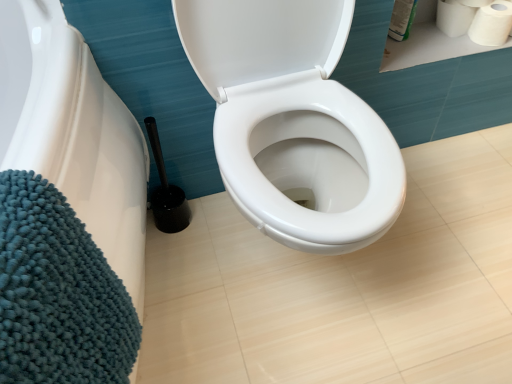
What is the approximate width of white matte toilet paper at upper right, arranged as the first toilet paper when viewed from the left?

The width of white matte toilet paper at upper right, arranged as the first toilet paper when viewed from the left, is 11.30 centimeters.

Measure the distance between white matte toilet paper at upper right, arranged as the first toilet paper when viewed from the left, and camera.

The distance of white matte toilet paper at upper right, arranged as the first toilet paper when viewed from the left, from camera is 3.95 feet.

Where is `black plastic toilet brush at lower left`? black plastic toilet brush at lower left is located at coordinates (166, 191).

Locate an element on the screen. This screenshot has height=384, width=512. white matte toilet paper at upper right, which is the 2th toilet paper in left-to-right order is located at coordinates (490, 24).

From a real-world perspective, is teal plush bath mat at lower left under black plastic toilet brush at lower left?

Incorrect, from a real-world perspective, teal plush bath mat at lower left is higher than black plastic toilet brush at lower left.

Does teal plush bath mat at lower left have a greater height compared to black plastic toilet brush at lower left?

Yes.

Considering the points (57, 77) and (166, 204), which point is in front, point (57, 77) or point (166, 204)?

The point (57, 77) is closer.

Can you see teal plush bath mat at lower left touching black plastic toilet brush at lower left?

teal plush bath mat at lower left and black plastic toilet brush at lower left are not in contact.

Considering the positions of points (120, 121) and (457, 16), is point (120, 121) closer to camera compared to point (457, 16)?

Yes.

Can we say teal plush bath mat at lower left lies outside white matte toilet paper at upper right, marked as the 2th toilet paper in a right-to-left arrangement?

Yes, teal plush bath mat at lower left is located beyond the bounds of white matte toilet paper at upper right, marked as the 2th toilet paper in a right-to-left arrangement.

From a real-world perspective, is teal plush bath mat at lower left physically located above or below white matte toilet paper at upper right, marked as the 2th toilet paper in a right-to-left arrangement?

teal plush bath mat at lower left is situated higher than white matte toilet paper at upper right, marked as the 2th toilet paper in a right-to-left arrangement, in the real world.

Which is more to the right, teal plush bath mat at lower left or white matte toilet paper at upper right, marked as the 2th toilet paper in a right-to-left arrangement?

From the viewer's perspective, white matte toilet paper at upper right, marked as the 2th toilet paper in a right-to-left arrangement, appears more on the right side.

From the image's perspective, which one is positioned higher, teal plush bath mat at lower left or white matte toilet paper at upper right, which is the 2th toilet paper in left-to-right order?

white matte toilet paper at upper right, which is the 2th toilet paper in left-to-right order, appears higher in the image.

Can you confirm if teal plush bath mat at lower left is positioned to the right of white matte toilet paper at upper right, the 1th toilet paper positioned from the right?

In fact, teal plush bath mat at lower left is to the left of white matte toilet paper at upper right, the 1th toilet paper positioned from the right.

What's the angular difference between teal plush bath mat at lower left and white matte toilet paper at upper right, which is the 2th toilet paper in left-to-right order,'s facing directions?

The angular difference between teal plush bath mat at lower left and white matte toilet paper at upper right, which is the 2th toilet paper in left-to-right order, is 65.6 degrees.

Which of these two, teal plush bath mat at lower left or white matte toilet paper at upper right, which is the 2th toilet paper in left-to-right order, is bigger?

Bigger between the two is teal plush bath mat at lower left.

Is white matte toilet paper at upper right, the 1th toilet paper positioned from the right, far away from teal plush bath mat at lower left?

Yes, white matte toilet paper at upper right, the 1th toilet paper positioned from the right, is far from teal plush bath mat at lower left.

From the image's perspective, would you say white matte toilet paper at upper right, the 1th toilet paper positioned from the right, is shown under teal plush bath mat at lower left?

No.

Is teal plush bath mat at lower left inside white matte toilet paper at upper right, the 1th toilet paper positioned from the right?

No, teal plush bath mat at lower left is not a part of white matte toilet paper at upper right, the 1th toilet paper positioned from the right.

Is point (504, 7) farther from viewer compared to point (36, 153)?

Yes, it is.

Does white matte toilet paper at upper right, the 1th toilet paper positioned from the right, have a smaller size compared to black plastic toilet brush at lower left?

Yes, white matte toilet paper at upper right, the 1th toilet paper positioned from the right, is smaller than black plastic toilet brush at lower left.

What's the angular difference between white matte toilet paper at upper right, which is the 2th toilet paper in left-to-right order, and black plastic toilet brush at lower left's facing directions?

1.42 degrees separate the facing orientations of white matte toilet paper at upper right, which is the 2th toilet paper in left-to-right order, and black plastic toilet brush at lower left.

Is white matte toilet paper at upper right, the 1th toilet paper positioned from the right, far away from black plastic toilet brush at lower left?

Actually, white matte toilet paper at upper right, the 1th toilet paper positioned from the right, and black plastic toilet brush at lower left are a little close together.

Is black plastic toilet brush at lower left oriented towards white matte toilet paper at upper right, marked as the 2th toilet paper in a right-to-left arrangement?

No, black plastic toilet brush at lower left does not turn towards white matte toilet paper at upper right, marked as the 2th toilet paper in a right-to-left arrangement.

Is black plastic toilet brush at lower left surrounding white matte toilet paper at upper right, marked as the 2th toilet paper in a right-to-left arrangement?

That's incorrect, white matte toilet paper at upper right, marked as the 2th toilet paper in a right-to-left arrangement, is not inside black plastic toilet brush at lower left.

From a real-world perspective, between black plastic toilet brush at lower left and white matte toilet paper at upper right, marked as the 2th toilet paper in a right-to-left arrangement, who is vertically higher?

In real-world perspective, white matte toilet paper at upper right, marked as the 2th toilet paper in a right-to-left arrangement, is above.

Between black plastic toilet brush at lower left and teal plush bath mat at lower left, which one has smaller size?

Smaller between the two is black plastic toilet brush at lower left.

How many degrees apart are the facing directions of black plastic toilet brush at lower left and teal plush bath mat at lower left?

The angular difference between black plastic toilet brush at lower left and teal plush bath mat at lower left is 64.1 degrees.

How distant is black plastic toilet brush at lower left from teal plush bath mat at lower left?

black plastic toilet brush at lower left and teal plush bath mat at lower left are 11.26 inches apart from each other.

Between black plastic toilet brush at lower left and teal plush bath mat at lower left, which one has more height?

Standing taller between the two is teal plush bath mat at lower left.

Identify the location of brush that is on the right side of teal plush bath mat at lower left. (166, 191).

The height and width of the screenshot is (384, 512). Identify the location of bath positioned vertically above the white matte toilet paper at upper right, arranged as the first toilet paper when viewed from the left (from a real-world perspective). (74, 132).

Based on their spatial positions, is black plastic toilet brush at lower left or white matte toilet paper at upper right, marked as the 2th toilet paper in a right-to-left arrangement, closer to teal plush bath mat at lower left?

black plastic toilet brush at lower left.

Which object lies further to the anchor point white matte toilet paper at upper right, the 1th toilet paper positioned from the right, black plastic toilet brush at lower left or teal plush bath mat at lower left?

teal plush bath mat at lower left is positioned further to the anchor white matte toilet paper at upper right, the 1th toilet paper positioned from the right.

Based on the photo, when comparing their distances from black plastic toilet brush at lower left, does white matte toilet paper at upper right, arranged as the first toilet paper when viewed from the left, or white matte toilet paper at upper right, the 1th toilet paper positioned from the right, seem further?

white matte toilet paper at upper right, the 1th toilet paper positioned from the right, is further to black plastic toilet brush at lower left.

Which object lies further to the anchor point teal plush bath mat at lower left, white matte toilet paper at upper right, marked as the 2th toilet paper in a right-to-left arrangement, or black plastic toilet brush at lower left?

Based on the image, white matte toilet paper at upper right, marked as the 2th toilet paper in a right-to-left arrangement, appears to be further to teal plush bath mat at lower left.

From the picture: Looking at the image, which one is located closer to black plastic toilet brush at lower left, teal plush bath mat at lower left or white matte toilet paper at upper right, marked as the 2th toilet paper in a right-to-left arrangement?

teal plush bath mat at lower left lies closer to black plastic toilet brush at lower left than the other object.

Estimate the real-world distances between objects in this image. Which object is closer to white matte toilet paper at upper right, the 1th toilet paper positioned from the right, teal plush bath mat at lower left or white matte toilet paper at upper right, arranged as the first toilet paper when viewed from the left?

white matte toilet paper at upper right, arranged as the first toilet paper when viewed from the left, is positioned closer to the anchor white matte toilet paper at upper right, the 1th toilet paper positioned from the right.

Which object lies nearer to the anchor point white matte toilet paper at upper right, arranged as the first toilet paper when viewed from the left, white matte toilet paper at upper right, which is the 2th toilet paper in left-to-right order, or teal plush bath mat at lower left?

Based on the image, white matte toilet paper at upper right, which is the 2th toilet paper in left-to-right order, appears to be nearer to white matte toilet paper at upper right, arranged as the first toilet paper when viewed from the left.

From the image, which object appears to be nearer to teal plush bath mat at lower left, white matte toilet paper at upper right, which is the 2th toilet paper in left-to-right order, or black plastic toilet brush at lower left?

The object closer to teal plush bath mat at lower left is black plastic toilet brush at lower left.

Image resolution: width=512 pixels, height=384 pixels. What are the coordinates of `brush located between teal plush bath mat at lower left and white matte toilet paper at upper right, arranged as the first toilet paper when viewed from the left, in the left-right direction` in the screenshot? It's located at (166, 191).

At what (x,y) coordinates should I click in order to perform the action: click on toilet paper situated between teal plush bath mat at lower left and white matte toilet paper at upper right, which is the 2th toilet paper in left-to-right order, from left to right. Please return your answer as a coordinate pair (x, y). This screenshot has width=512, height=384. Looking at the image, I should click on (455, 16).

The height and width of the screenshot is (384, 512). Find the location of `brush between teal plush bath mat at lower left and white matte toilet paper at upper right, which is the 2th toilet paper in left-to-right order`. brush between teal plush bath mat at lower left and white matte toilet paper at upper right, which is the 2th toilet paper in left-to-right order is located at coordinates (166, 191).

Where is `toilet paper between black plastic toilet brush at lower left and white matte toilet paper at upper right, the 1th toilet paper positioned from the right, in the horizontal direction`? toilet paper between black plastic toilet brush at lower left and white matte toilet paper at upper right, the 1th toilet paper positioned from the right, in the horizontal direction is located at coordinates (455, 16).